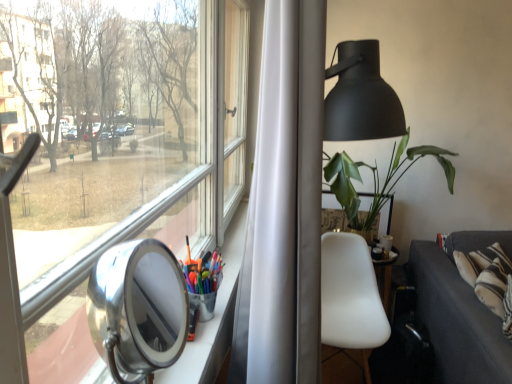
Find the location of a particular element. dark gray fabric couch at lower right is located at coordinates (459, 311).

The height and width of the screenshot is (384, 512). I want to click on white matte chair at center-right, so click(x=350, y=301).

What do you see at coordinates (361, 97) in the screenshot? I see `matte black table lamp at upper right` at bounding box center [361, 97].

Find the location of a particular element. Image resolution: width=512 pixels, height=384 pixels. green matte plant at right is located at coordinates (377, 178).

Considering the relative sizes of polished silver view mirror at lower left and dark gray fabric couch at lower right in the image provided, is polished silver view mirror at lower left smaller than dark gray fabric couch at lower right?

Yes, polished silver view mirror at lower left is smaller than dark gray fabric couch at lower right.

Can you confirm if polished silver view mirror at lower left is positioned to the right of dark gray fabric couch at lower right?

No.

Is dark gray fabric couch at lower right completely or partially inside polished silver view mirror at lower left?

No, dark gray fabric couch at lower right is not a part of polished silver view mirror at lower left.

Can you tell me how much polished silver view mirror at lower left and dark gray fabric couch at lower right differ in facing direction?

3.73 degrees separate the facing orientations of polished silver view mirror at lower left and dark gray fabric couch at lower right.

In the scene shown: Which object is positioned more to the left, green matte plant at right or dark gray fabric couch at lower right?

green matte plant at right is more to the left.

Is green matte plant at right oriented away from dark gray fabric couch at lower right?

green matte plant at right does not have its back to dark gray fabric couch at lower right.

This screenshot has width=512, height=384. I want to click on houseplant on the left of dark gray fabric couch at lower right, so click(x=377, y=178).

Considering the points (417, 160) and (416, 278), which point is behind, point (417, 160) or point (416, 278)?

The point (417, 160) is farther from the camera.

Is point (366, 368) closer or farther from the camera than point (334, 177)?

Point (366, 368) appears to be farther away from the viewer than point (334, 177).

Is white matte chair at center-right turned away from green matte plant at right?

No, green matte plant at right is not at the back of white matte chair at center-right.

Looking at this image, is white matte chair at center-right not close to green matte plant at right?

white matte chair at center-right is actually quite close to green matte plant at right.

Can green matte plant at right be found inside white matte chair at center-right?

Definitely not — green matte plant at right is not inside white matte chair at center-right.

Is green matte plant at right taller than white matte chair at center-right?

In fact, green matte plant at right may be shorter than white matte chair at center-right.

Who is bigger, green matte plant at right or white matte chair at center-right?

green matte plant at right is bigger.

From the image's perspective, between green matte plant at right and white matte chair at center-right, who is located below?

white matte chair at center-right.

Is white matte chair at center-right placed right next to matte black table lamp at upper right?

No, white matte chair at center-right is not in contact with matte black table lamp at upper right.

You are a GUI agent. You are given a task and a screenshot of the screen. Output one action in this format:
    pyautogui.click(x=<x>, y=<y>)
    Task: Click on the chair below the matte black table lamp at upper right (from a real-world perspective)
    The width and height of the screenshot is (512, 384).
    Given the screenshot: What is the action you would take?
    pyautogui.click(x=350, y=301)

From a real-world perspective, is white matte chair at center-right positioned over matte black table lamp at upper right based on gravity?

No.

Does green matte plant at right have a larger size compared to polished silver view mirror at lower left?

Indeed, green matte plant at right has a larger size compared to polished silver view mirror at lower left.

Which is more to the right, green matte plant at right or polished silver view mirror at lower left?

From the viewer's perspective, green matte plant at right appears more on the right side.

In the scene shown: Can you confirm if green matte plant at right is thinner than polished silver view mirror at lower left?

In fact, green matte plant at right might be wider than polished silver view mirror at lower left.

Between polished silver view mirror at lower left and white matte chair at center-right, which one appears on the left side from the viewer's perspective?

polished silver view mirror at lower left.

Measure the distance between polished silver view mirror at lower left and white matte chair at center-right.

polished silver view mirror at lower left is 5.67 feet away from white matte chair at center-right.

From the image's perspective, is polished silver view mirror at lower left below white matte chair at center-right?

No, from the image's perspective, polished silver view mirror at lower left is not beneath white matte chair at center-right.

In the image, there is a polished silver view mirror at lower left. Where is `studio couch below it (from the image's perspective)`? studio couch below it (from the image's perspective) is located at coordinates (459, 311).

Locate an element on the screen. houseplant above the dark gray fabric couch at lower right (from the image's perspective) is located at coordinates click(377, 178).

When comparing their distances from polished silver view mirror at lower left, does white matte chair at center-right or green matte plant at right seem closer?

Among the two, white matte chair at center-right is located nearer to polished silver view mirror at lower left.

When comparing their distances from green matte plant at right, does white matte chair at center-right or matte black table lamp at upper right seem closer?

The object closer to green matte plant at right is matte black table lamp at upper right.

Which object lies further to the anchor point white matte chair at center-right, polished silver view mirror at lower left or dark gray fabric couch at lower right?

Based on the image, polished silver view mirror at lower left appears to be further to white matte chair at center-right.

From the image, which object appears to be nearer to white matte chair at center-right, matte black table lamp at upper right or dark gray fabric couch at lower right?

dark gray fabric couch at lower right.

When comparing their distances from matte black table lamp at upper right, does polished silver view mirror at lower left or dark gray fabric couch at lower right seem closer?

Based on the image, dark gray fabric couch at lower right appears to be nearer to matte black table lamp at upper right.

Which object lies nearer to the anchor point white matte chair at center-right, polished silver view mirror at lower left or green matte plant at right?

The object closer to white matte chair at center-right is green matte plant at right.

Based on their spatial positions, is matte black table lamp at upper right or polished silver view mirror at lower left closer to white matte chair at center-right?

Based on the image, matte black table lamp at upper right appears to be nearer to white matte chair at center-right.

Which object lies further to the anchor point polished silver view mirror at lower left, dark gray fabric couch at lower right or green matte plant at right?

green matte plant at right.

Find the location of a particular element. The image size is (512, 384). houseplant located between polished silver view mirror at lower left and dark gray fabric couch at lower right in the left-right direction is located at coordinates (377, 178).

Find the location of a particular element. This screenshot has width=512, height=384. houseplant between matte black table lamp at upper right and dark gray fabric couch at lower right is located at coordinates (377, 178).

At what (x,y) coordinates should I click in order to perform the action: click on houseplant between white matte chair at center-right and dark gray fabric couch at lower right in the horizontal direction. Please return your answer as a coordinate pair (x, y). Looking at the image, I should click on (377, 178).

The width and height of the screenshot is (512, 384). Identify the location of chair between polished silver view mirror at lower left and green matte plant at right along the z-axis. pos(350,301).